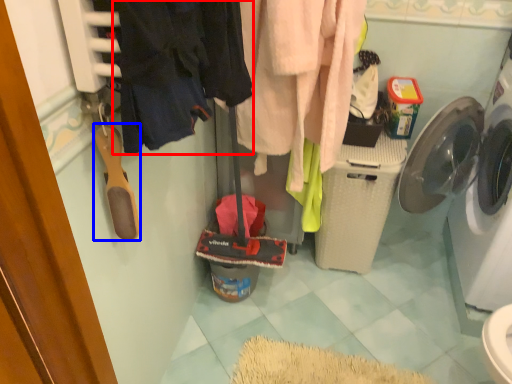
Question: Which of the following is the farthest to the observer, clothing (highlighted by a red box) or shoe (highlighted by a blue box)?

Choices:
 (A) clothing
 (B) shoe

Answer: (B)